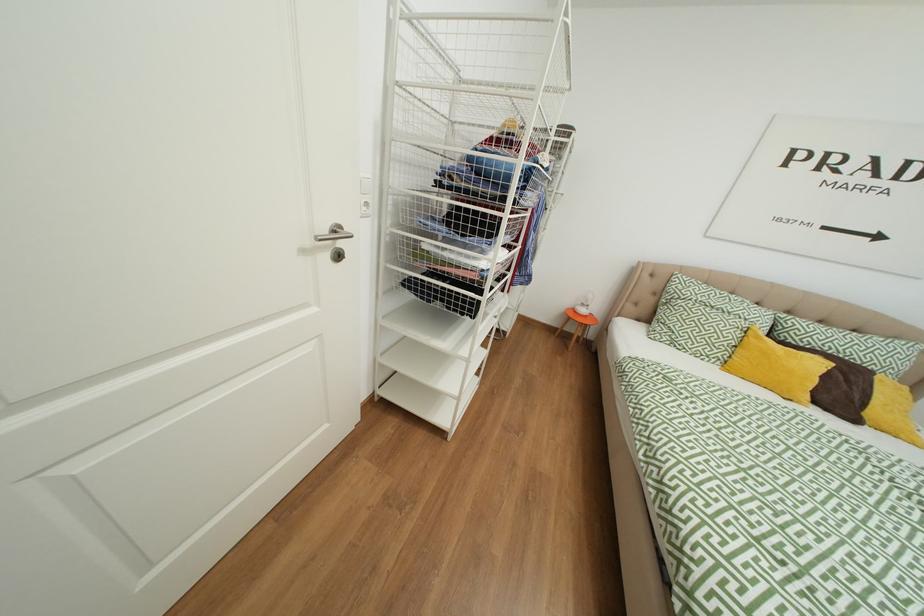
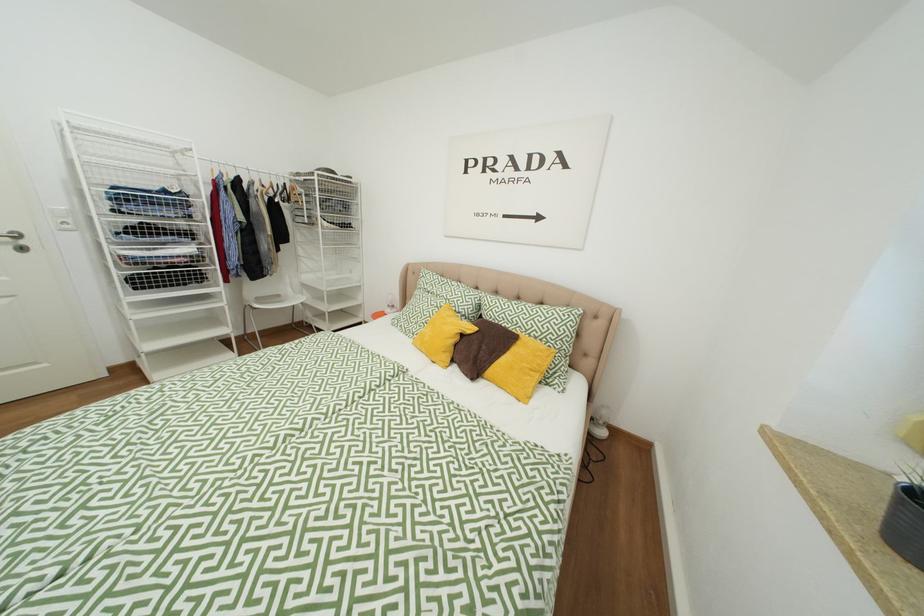
Question: In a continuous first-person perspective shot, in which direction is the camera moving?

Choices:
 (A) Left
 (B) Right
 (C) Forward
 (D) Backward

Answer: (B)